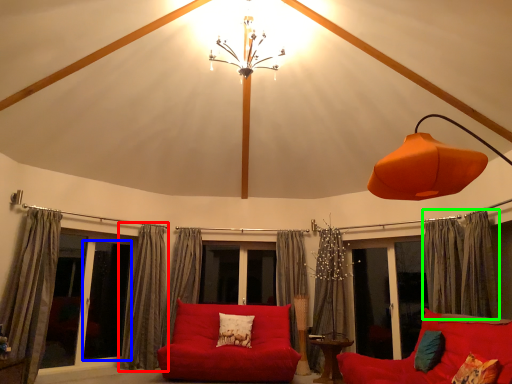
Question: Estimate the real-world distances between objects in this image. Which object is farther from curtain (highlighted by a red box), screen door (highlighted by a blue box) or curtain (highlighted by a green box)?

Choices:
 (A) screen door
 (B) curtain

Answer: (B)